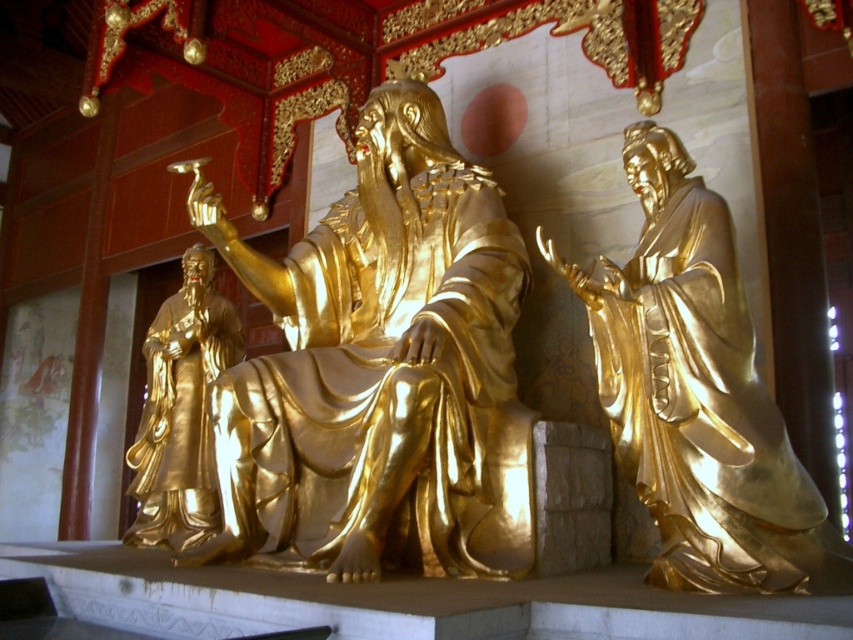
Question: Which object is the closest to the gold polished statue at right?

Choices:
 (A) gold polished statue at left
 (B) gold polished statue at center

Answer: (B)

Question: Does gold polished statue at right appear under gold polished statue at left?

Choices:
 (A) no
 (B) yes

Answer: (A)

Question: Which point is closer to the camera?

Choices:
 (A) gold polished statue at right
 (B) gold polished statue at center
 (C) gold polished statue at left

Answer: (A)

Question: Does gold polished statue at right appear on the right side of gold polished statue at left?

Choices:
 (A) yes
 (B) no

Answer: (A)

Question: Where is gold polished statue at right located in relation to gold polished statue at left in the image?

Choices:
 (A) right
 (B) left

Answer: (A)

Question: Estimate the real-world distances between objects in this image. Which object is closer to the gold polished statue at center?

Choices:
 (A) gold polished statue at left
 (B) gold polished statue at right

Answer: (A)